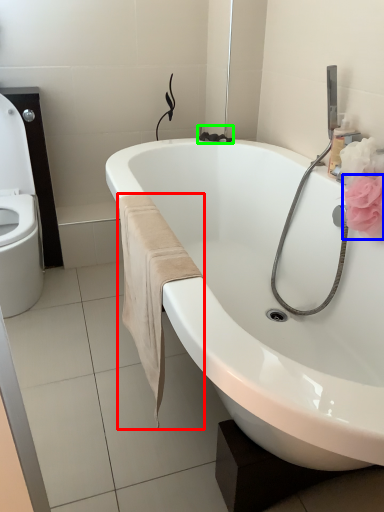
Question: Based on their relative distances, which object is nearer to bath towel (highlighted by a red box)? Choose from flower (highlighted by a blue box) and plumbing fixture (highlighted by a green box).

Choices:
 (A) flower
 (B) plumbing fixture

Answer: (A)